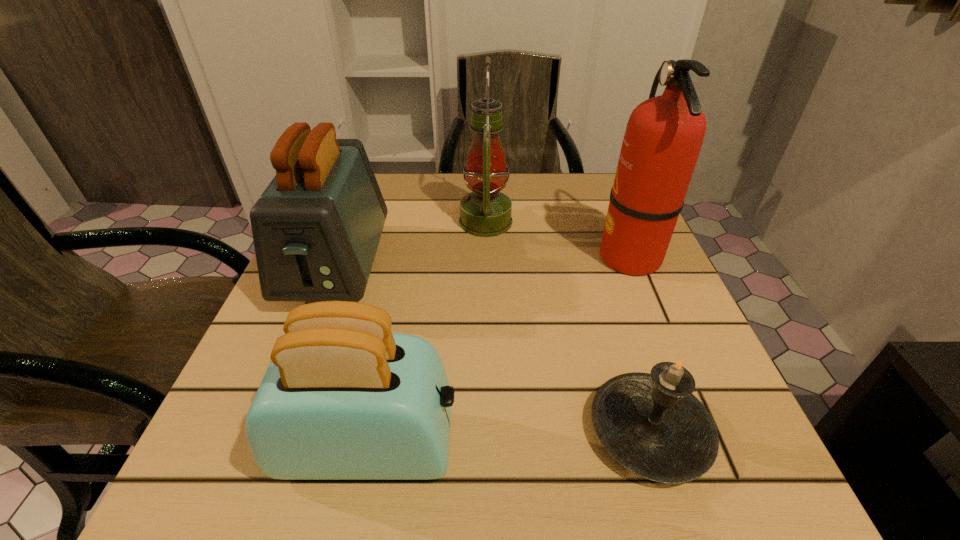
The image size is (960, 540). In order to click on blank region between the oil lamp and the nearer toaster in this screenshot , I will do `click(428, 334)`.

What are the coordinates of `vacant space that's between the shortest object and the oil lamp` in the screenshot? It's located at (567, 327).

I want to click on vacant area between the candle and the farther toaster, so tap(493, 349).

Find the location of a particular element. This screenshot has width=960, height=540. vacant area that lies between the candle and the oil lamp is located at coordinates (567, 327).

You are a GUI agent. You are given a task and a screenshot of the screen. Output one action in this format:
    pyautogui.click(x=<x>, y=<y>)
    Task: Click on the object that can be found as the closest to the nearer toaster
    Image resolution: width=960 pixels, height=540 pixels.
    Given the screenshot: What is the action you would take?
    pyautogui.click(x=316, y=228)

Choose which object is the second nearest neighbor to the oil lamp. Please provide its 2D coordinates. Your answer should be formatted as a tuple, i.e. [(x, y)], where the tuple contains the x and y coordinates of a point satisfying the conditions above.

[(663, 138)]

I want to click on free spot that satisfies the following two spatial constraints: 1. on the front-facing side of the farther toaster; 2. on the right side of the shortest object, so click(274, 431).

At what (x,y) coordinates should I click in order to perform the action: click on free space that satisfies the following two spatial constraints: 1. on the side of the fire extinguisher with the nozzle and handle; 2. on the front-facing side of the farther toaster. Please return your answer as a coordinate pair (x, y). The height and width of the screenshot is (540, 960). Looking at the image, I should click on (634, 266).

This screenshot has height=540, width=960. I want to click on vacant area in the image that satisfies the following two spatial constraints: 1. on the front-facing side of the farther toaster; 2. on the right side of the candle, so click(274, 431).

You are a GUI agent. You are given a task and a screenshot of the screen. Output one action in this format:
    pyautogui.click(x=<x>, y=<y>)
    Task: Click on the free space that satisfies the following two spatial constraints: 1. on the front-facing side of the farther toaster; 2. on the right side of the candle
    
    Given the screenshot: What is the action you would take?
    pyautogui.click(x=274, y=431)